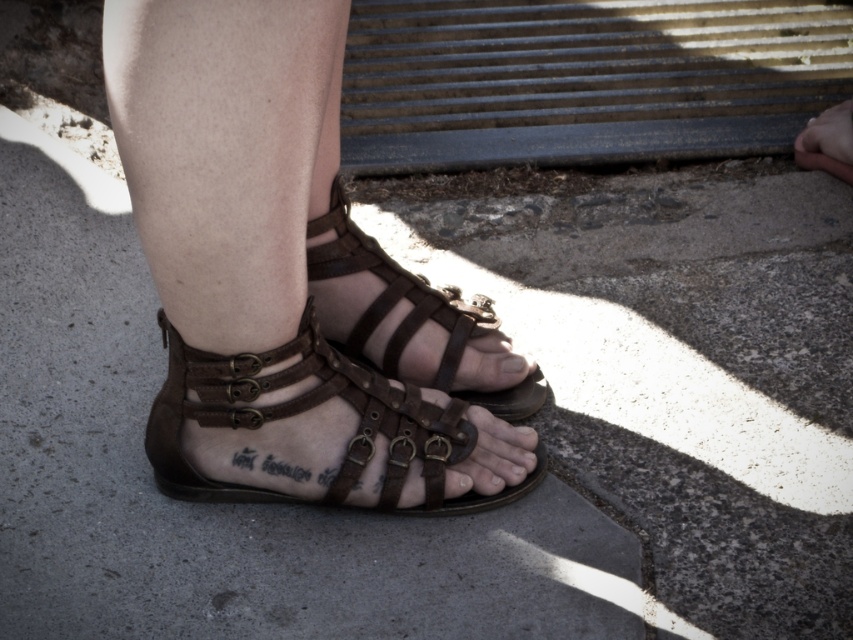
Is point (181, 301) in front of point (381, 369)?

Yes, it is.

Is brown leather sandals at center thinner than brown leather sandal at center?

In fact, brown leather sandals at center might be wider than brown leather sandal at center.

Is point (281, 64) more distant than point (395, 337)?

No, (281, 64) is closer to viewer.

Find the location of `brown leather sandals at center`. brown leather sandals at center is located at coordinates 292,280.

Measure the distance between brown leather sandals at center and camera.

brown leather sandals at center is 30.13 inches away from camera.

Which is below, brown leather sandals at center or brown leather sandals at lower center?

Positioned lower is brown leather sandals at lower center.

Who is more forward, (486, 324) or (425, 474)?

Positioned in front is point (425, 474).

This screenshot has width=853, height=640. I want to click on brown leather sandals at center, so click(292, 280).

Which of these two, brown leather sandal at center or brown leather toe at center, stands shorter?

brown leather toe at center

Is brown leather sandal at center to the left of brown leather toe at center from the viewer's perspective?

Indeed, brown leather sandal at center is positioned on the left side of brown leather toe at center.

Does point (397, 346) lie behind point (515, 365)?

No, (397, 346) is in front of (515, 365).

This screenshot has width=853, height=640. Identify the location of brown leather sandal at center. (409, 310).